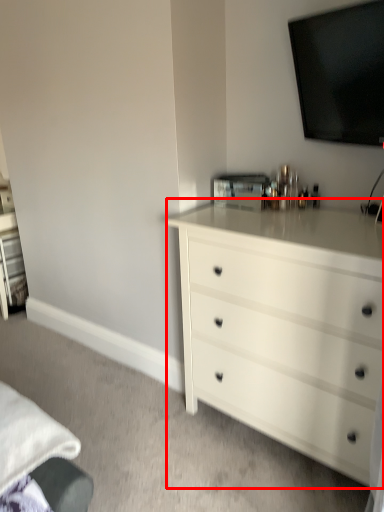
Question: From the image's perspective, what is the correct spatial positioning of chest of drawers (annotated by the red box) in reference to television?

Choices:
 (A) above
 (B) below

Answer: (B)